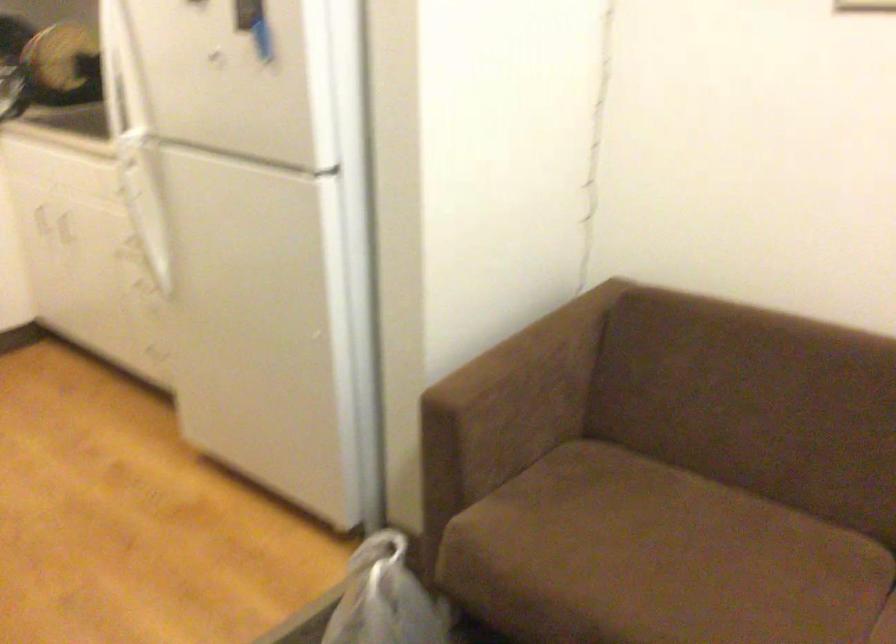
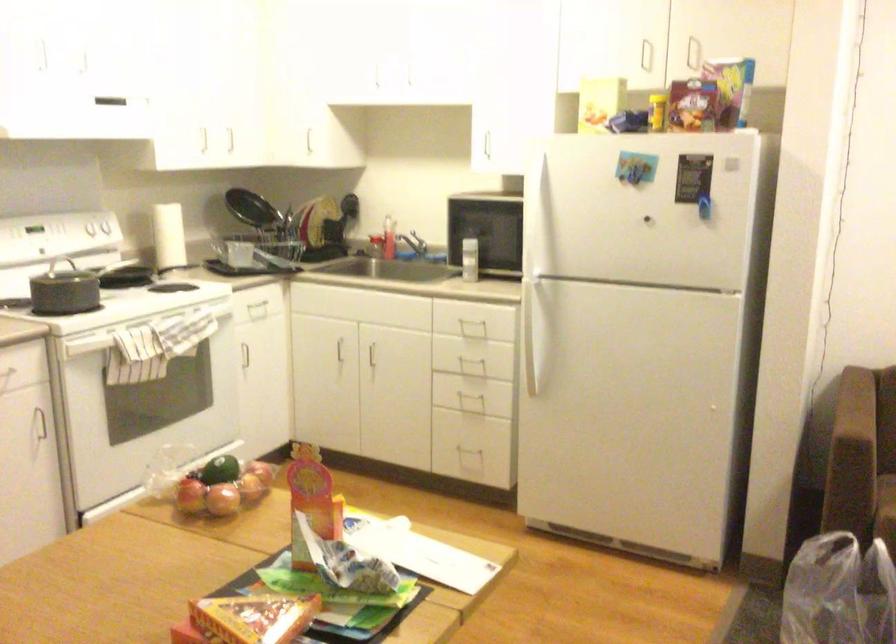
The point at (149, 216) is marked in the first image. Where is the corresponding point in the second image?

(536, 328)